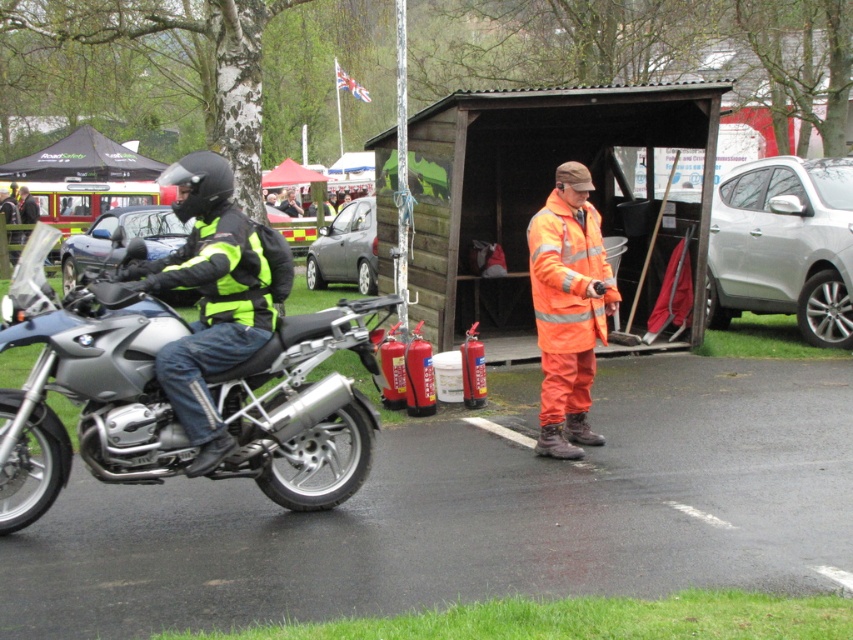
Question: Which of the following is the closest to the observer?

Choices:
 (A) (831, 163)
 (B) (125, 256)
 (C) (581, 182)
 (D) (212, 161)

Answer: (D)

Question: Is the position of matte black motorcycle at left more distant than that of metallic gray hatchback at center?

Choices:
 (A) no
 (B) yes

Answer: (A)

Question: Which point appears farthest from the camera in this image?

Choices:
 (A) (119, 256)
 (B) (755, 275)
 (C) (283, 369)

Answer: (A)

Question: Does matte black motorcycle at left appear under silver metallic car at center?

Choices:
 (A) no
 (B) yes

Answer: (A)

Question: Where is wooden shed at center located in relation to matte black motorcycle at left in the image?

Choices:
 (A) left
 (B) right

Answer: (B)

Question: Which point is closer to the camera taking this photo?

Choices:
 (A) (773, 285)
 (B) (202, 244)

Answer: (B)